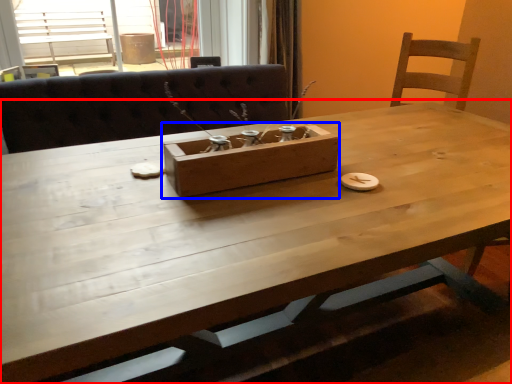
Question: Which object is further to the camera taking this photo, table (highlighted by a red box) or cardboard box (highlighted by a blue box)?

Choices:
 (A) table
 (B) cardboard box

Answer: (B)